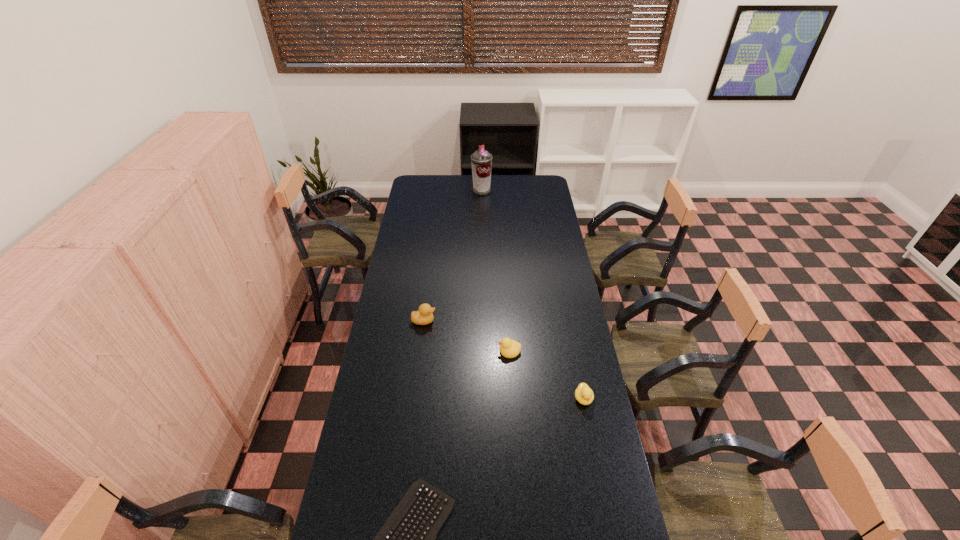
I want to click on vacant region located on the beak of the rightmost object, so click(593, 449).

Where is `free location located 0.270m on the face of the second duckling from left to right`? free location located 0.270m on the face of the second duckling from left to right is located at coordinates (432, 351).

This screenshot has height=540, width=960. I want to click on free spot located 0.260m on the face of the second duckling from left to right, so click(x=434, y=351).

The height and width of the screenshot is (540, 960). I want to click on free space located 0.230m on the face of the second duckling from left to right, so click(x=442, y=351).

The image size is (960, 540). I want to click on object located at the far edge, so click(x=481, y=160).

This screenshot has width=960, height=540. Identify the location of object present at the left edge. (424, 316).

This screenshot has width=960, height=540. Find the location of `object situated at the right edge`. object situated at the right edge is located at coordinates (584, 395).

In the image, there is a desktop. Identify the location of free space at the far edge. The image size is (960, 540). (463, 188).

Where is `free space at the left edge of the desktop`? The width and height of the screenshot is (960, 540). free space at the left edge of the desktop is located at coordinates (418, 203).

The width and height of the screenshot is (960, 540). Identify the location of vacant space at the right edge of the desktop. (564, 453).